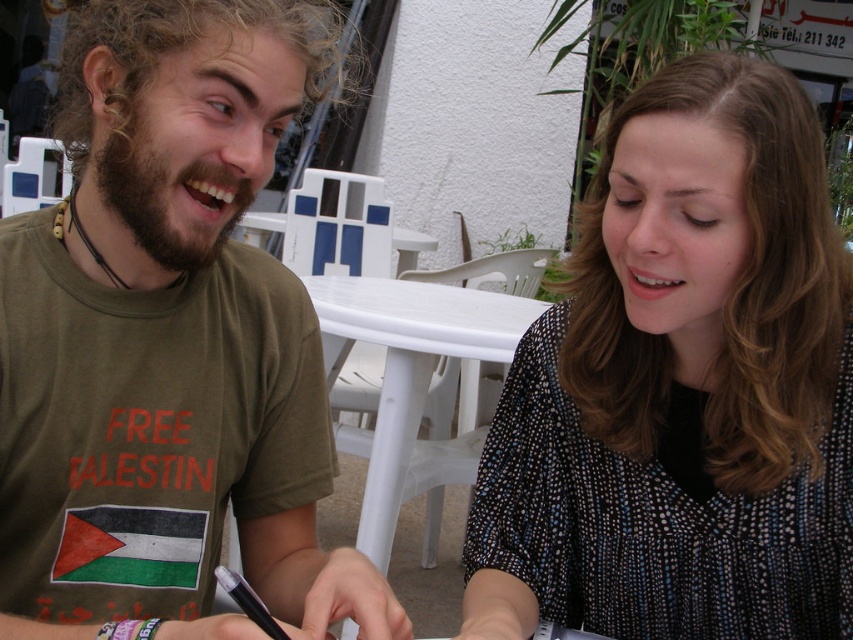
Question: Is green matte t-shirt at center smaller than white plastic table at center?

Choices:
 (A) yes
 (B) no

Answer: (A)

Question: Is green matte t-shirt at center positioned before black dotted blouse at center?

Choices:
 (A) no
 (B) yes

Answer: (B)

Question: Which of the following is the closest to the observer?

Choices:
 (A) (521, 308)
 (B) (281, 452)
 (C) (683, 140)

Answer: (C)

Question: Which point appears closest to the camera in this image?

Choices:
 (A) (225, 592)
 (B) (366, 483)
 (C) (265, 320)
 (D) (577, 262)

Answer: (A)

Question: Can you confirm if green matte t-shirt at center is positioned to the right of black plastic pen at lower center?

Choices:
 (A) yes
 (B) no

Answer: (B)

Question: Which point appears closest to the camera in this image?

Choices:
 (A) (247, 592)
 (B) (468, 301)
 (C) (173, 426)
 (D) (724, 330)

Answer: (A)